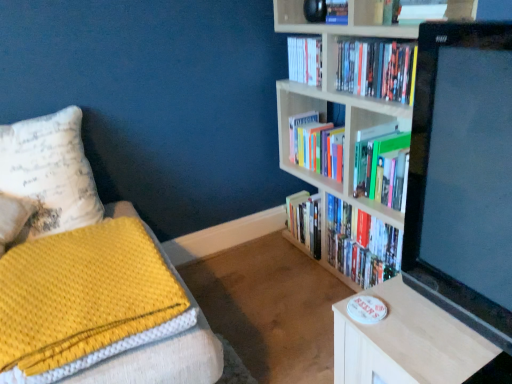
Locate an element on the screen. free area below black glossy monitor at upper right (from a real-world perspective) is located at coordinates (443, 341).